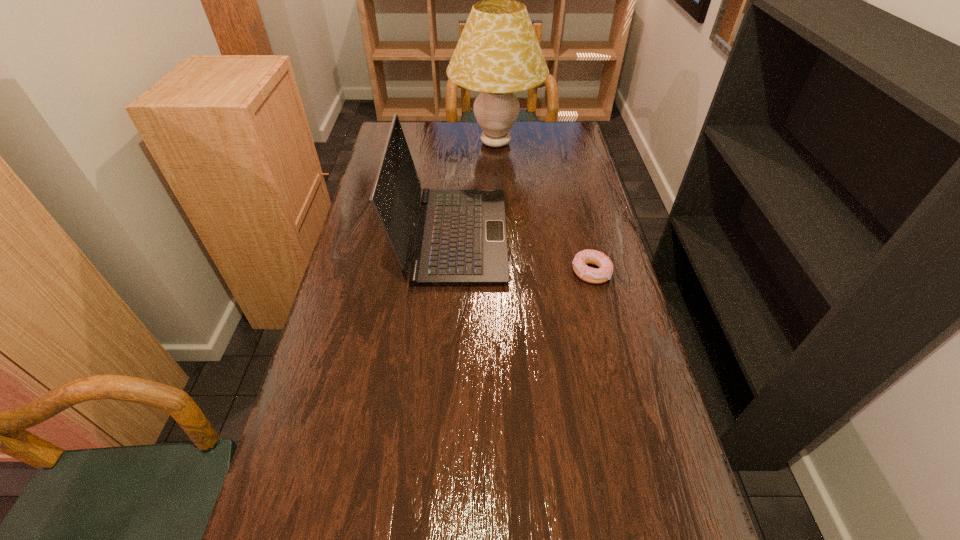
You are a GUI agent. You are given a task and a screenshot of the screen. Output one action in this format:
    pyautogui.click(x=<x>, y=<y>)
    Task: Click on the lampshade
    This screenshot has width=960, height=540.
    Given the screenshot: What is the action you would take?
    pyautogui.click(x=498, y=54)

Where is `the farthest object`? This screenshot has height=540, width=960. the farthest object is located at coordinates (498, 54).

The height and width of the screenshot is (540, 960). In order to click on laptop computer in this screenshot , I will do `click(461, 239)`.

This screenshot has width=960, height=540. Find the location of `the shortest object`. the shortest object is located at coordinates (602, 274).

Locate an element on the screen. This screenshot has width=960, height=540. doughnut is located at coordinates pyautogui.click(x=602, y=274).

This screenshot has width=960, height=540. I want to click on vacant space positioned 0.200m on the left of the lampshade, so click(x=397, y=143).

At what (x,y) coordinates should I click in order to perform the action: click on free location located on the screen of the second tallest object. Please return your answer as a coordinate pair (x, y). The width and height of the screenshot is (960, 540). Looking at the image, I should click on (607, 236).

This screenshot has height=540, width=960. I want to click on free space located on the front of the rightmost object, so click(x=606, y=332).

Locate an element on the screen. object positioned at the far edge is located at coordinates (498, 54).

Identify the location of object that is positioned at the left edge. (461, 239).